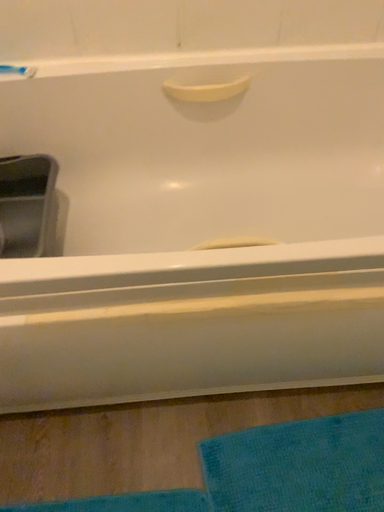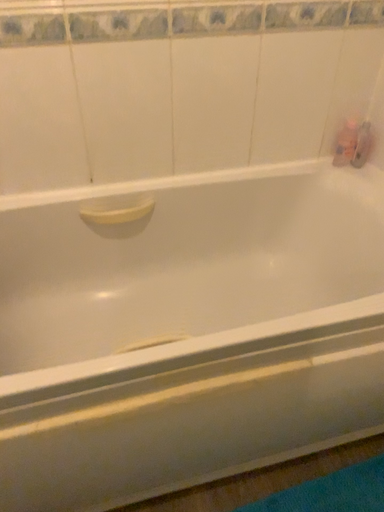
Question: How did the camera likely rotate when shooting the video?

Choices:
 (A) rotated left
 (B) rotated right

Answer: (B)